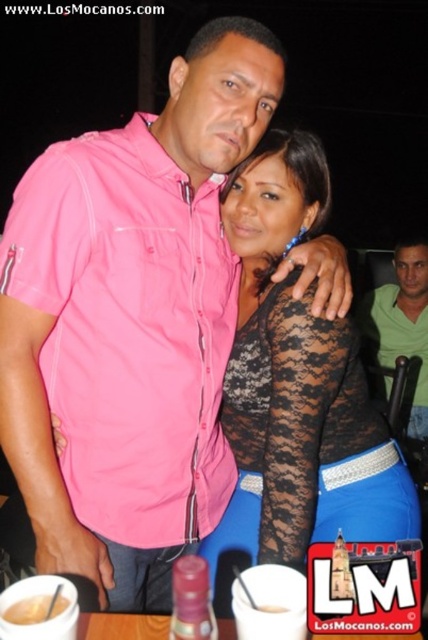
Identify the location of green matte shirt at right. (403, 323).

Image resolution: width=428 pixels, height=640 pixels. Identify the location of green matte shirt at right. (403, 323).

Find the location of a particular element. The height and width of the screenshot is (640, 428). green matte shirt at right is located at coordinates (403, 323).

Is point (360, 396) positioned behind point (415, 314)?

No, (360, 396) is closer to viewer.

Between lace fabric top at center and green matte shirt at right, which one is positioned higher?

green matte shirt at right

Between point (279, 376) and point (424, 428), which one is positioned in front?

Point (279, 376) is more forward.

Locate an element on the screen. The height and width of the screenshot is (640, 428). lace fabric top at center is located at coordinates (296, 388).

Is pink cotton shirt at center below white glossy mug at lower center?

Actually, pink cotton shirt at center is above white glossy mug at lower center.

Is pink cotton shirt at center bigger than white glossy mug at lower center?

Yes.

Locate an element on the screen. pink cotton shirt at center is located at coordinates (128, 330).